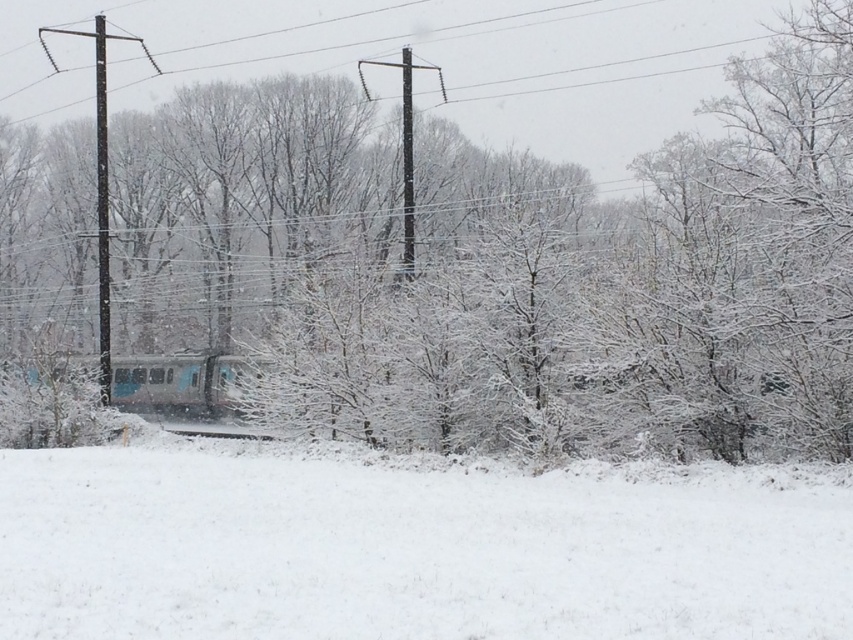
Question: Among these points, which one is farthest from the camera?

Choices:
 (A) (105, 300)
 (B) (207, 541)
 (C) (196, 426)

Answer: (C)

Question: Can you confirm if white fluffy snow at lower center is positioned below black wooden telegraph pole at left?

Choices:
 (A) yes
 (B) no

Answer: (A)

Question: Is white fluffy snow at lower center positioned in front of black wooden telegraph pole at left?

Choices:
 (A) no
 (B) yes

Answer: (B)

Question: Can you confirm if black wooden telegraph pole at left is smaller than smooth concrete train track at center?

Choices:
 (A) yes
 (B) no

Answer: (B)

Question: Which object appears closest to the camera in this image?

Choices:
 (A) white fluffy snow at lower center
 (B) smooth concrete train track at center

Answer: (A)

Question: Which of these objects is positioned closest to the black wooden telegraph pole at left?

Choices:
 (A) white fluffy snow at lower center
 (B) smooth concrete train track at center

Answer: (B)